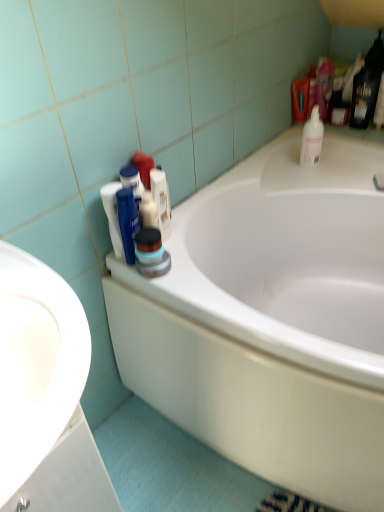
Identify the location of space that is in front of white matte shaving cream at upper center. Image resolution: width=384 pixels, height=512 pixels. (182, 272).